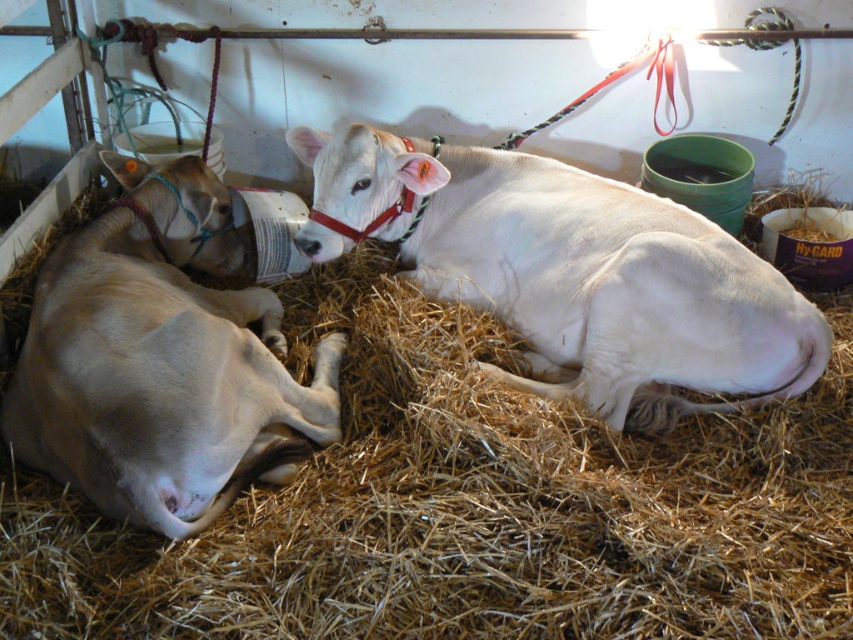
Question: Which is nearer to the white smooth cow at center?

Choices:
 (A) light brown smooth cow at left
 (B) brown straw at center

Answer: (B)

Question: Observing the image, what is the correct spatial positioning of brown straw at center in reference to light brown smooth cow at left?

Choices:
 (A) right
 (B) left

Answer: (A)

Question: Is brown straw at center to the left of white smooth cow at center from the viewer's perspective?

Choices:
 (A) yes
 (B) no

Answer: (A)

Question: Which of the following is the closest to the observer?

Choices:
 (A) light brown smooth cow at left
 (B) brown straw at center

Answer: (B)

Question: Among these objects, which one is nearest to the camera?

Choices:
 (A) white smooth cow at center
 (B) light brown smooth cow at left

Answer: (B)

Question: Does white smooth cow at center appear on the left side of light brown smooth cow at left?

Choices:
 (A) no
 (B) yes

Answer: (A)